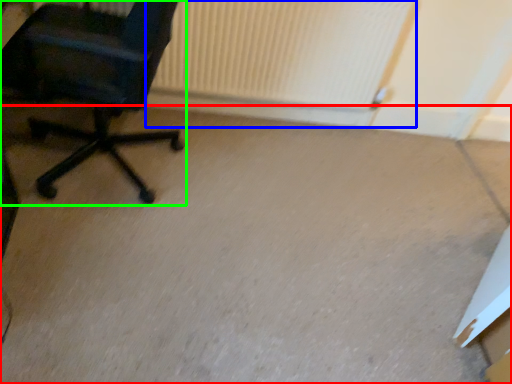
Question: Estimate the real-world distances between objects in this image. Which object is closer to concrete (highlighted by a red box), radiator (highlighted by a blue box) or chair (highlighted by a green box)?

Choices:
 (A) radiator
 (B) chair

Answer: (A)